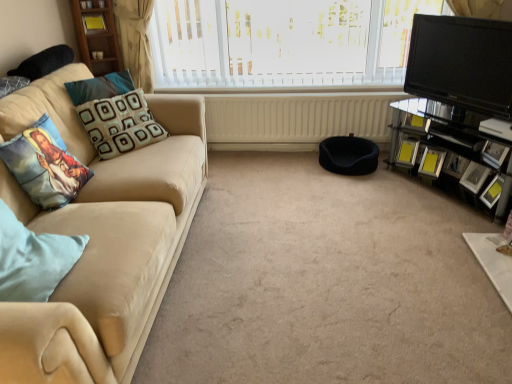
You are a GUI agent. You are given a task and a screenshot of the screen. Output one action in this format:
    pyautogui.click(x=<x>, y=<y>)
    Task: Click on the free space between black glossy entertainment center at right and black fabric footrest at center
    
    Given the screenshot: What is the action you would take?
    pos(398,190)